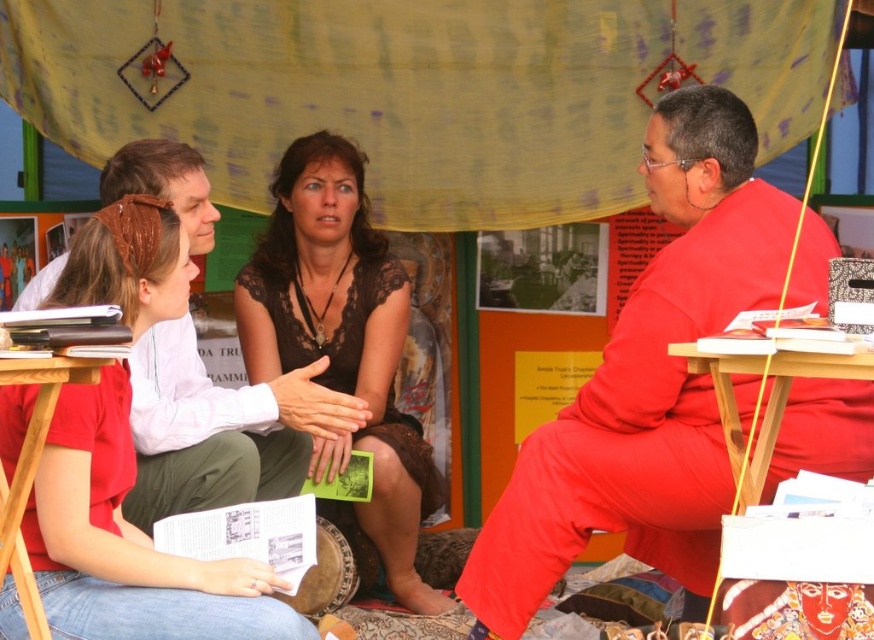
Is matte red robe at center smaller than black lace dress at center?

Answer: No, matte red robe at center is not smaller than black lace dress at center.

Can you confirm if matte red robe at center is taller than black lace dress at center?

In fact, matte red robe at center may be shorter than black lace dress at center.

Does point (786, 465) come in front of point (283, 184)?

Yes.

Identify the location of matte red robe at center. (646, 381).

Does black lace dress at center appear on the left side of matte white shirt at center?

In fact, black lace dress at center is to the right of matte white shirt at center.

Consider the image. Is black lace dress at center wider than matte white shirt at center?

Yes, black lace dress at center is wider than matte white shirt at center.

This screenshot has height=640, width=874. I want to click on black lace dress at center, so click(x=344, y=353).

In the scene shown: Does matte red robe at center have a greater width compared to matte white shirt at center?

Indeed, matte red robe at center has a greater width compared to matte white shirt at center.

Is matte red robe at center to the right of matte white shirt at center from the viewer's perspective?

Yes, matte red robe at center is to the right of matte white shirt at center.

This screenshot has height=640, width=874. I want to click on matte red robe at center, so click(x=646, y=381).

At what (x,y) coordinates should I click in order to perform the action: click on matte red robe at center. Please return your answer as a coordinate pair (x, y). This screenshot has width=874, height=640. Looking at the image, I should click on (646, 381).